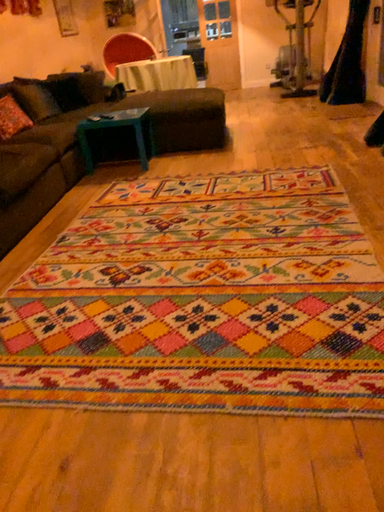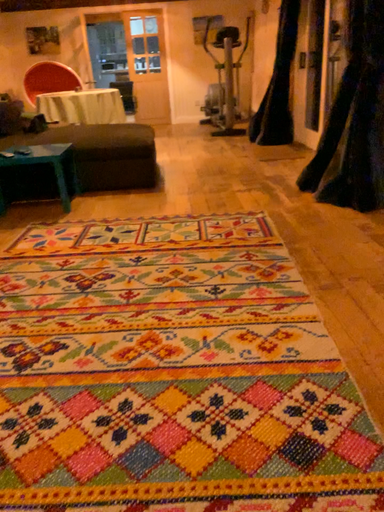
Question: Which way did the camera rotate in the video?

Choices:
 (A) rotated right
 (B) rotated left

Answer: (A)